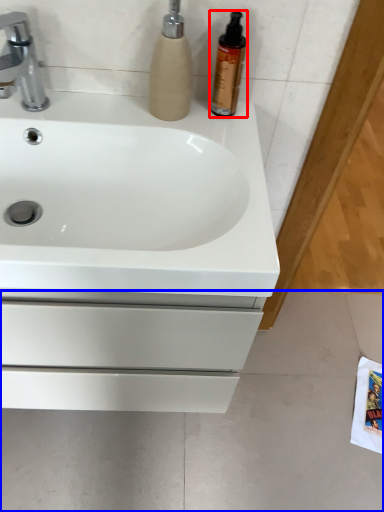
Question: Which object is closer to the camera taking this photo, cleaning product (highlighted by a red box) or concrete (highlighted by a blue box)?

Choices:
 (A) cleaning product
 (B) concrete

Answer: (A)